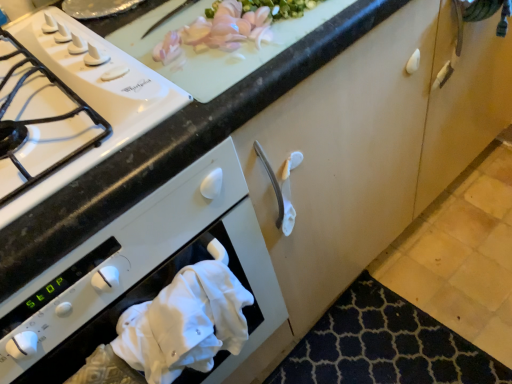
Question: Can you confirm if white cloth at lower left is positioned to the right of white cotton hand towel at lower left?

Choices:
 (A) no
 (B) yes

Answer: (A)

Question: From a real-world perspective, is white cloth at lower left on white cotton hand towel at lower left?

Choices:
 (A) no
 (B) yes

Answer: (A)

Question: Could you tell me if white cloth at lower left is facing white cotton hand towel at lower left?

Choices:
 (A) yes
 (B) no

Answer: (B)

Question: Is white cloth at lower left outside of white cotton hand towel at lower left?

Choices:
 (A) no
 (B) yes

Answer: (B)

Question: From the image's perspective, is white cloth at lower left over white cotton hand towel at lower left?

Choices:
 (A) no
 (B) yes

Answer: (A)

Question: In terms of height, does dark blue textured mat at lower right look taller or shorter compared to white glossy gas stove at left?

Choices:
 (A) tall
 (B) short

Answer: (B)

Question: From a real-world perspective, is dark blue textured mat at lower right physically located above or below white glossy gas stove at left?

Choices:
 (A) above
 (B) below

Answer: (B)

Question: Is dark blue textured mat at lower right in front of or behind white glossy gas stove at left in the image?

Choices:
 (A) behind
 (B) front

Answer: (A)

Question: Considering the positions of dark blue textured mat at lower right and white glossy gas stove at left in the image, is dark blue textured mat at lower right bigger or smaller than white glossy gas stove at left?

Choices:
 (A) small
 (B) big

Answer: (B)

Question: From a real-world perspective, is white fabric at lower left above or below white glossy gas stove at left?

Choices:
 (A) below
 (B) above

Answer: (A)

Question: Considering the positions of white fabric at lower left and white glossy gas stove at left in the image, is white fabric at lower left wider or thinner than white glossy gas stove at left?

Choices:
 (A) wide
 (B) thin

Answer: (A)

Question: Is white fabric at lower left taller or shorter than white glossy gas stove at left?

Choices:
 (A) short
 (B) tall

Answer: (B)

Question: Is point (79, 314) positioned closer to the camera than point (40, 172)?

Choices:
 (A) closer
 (B) farther

Answer: (B)

Question: Considering the relative positions of white cotton hand towel at lower left and dark blue textured mat at lower right in the image provided, is white cotton hand towel at lower left to the left or to the right of dark blue textured mat at lower right?

Choices:
 (A) left
 (B) right

Answer: (A)

Question: Is white cotton hand towel at lower left wider or thinner than dark blue textured mat at lower right?

Choices:
 (A) wide
 (B) thin

Answer: (B)